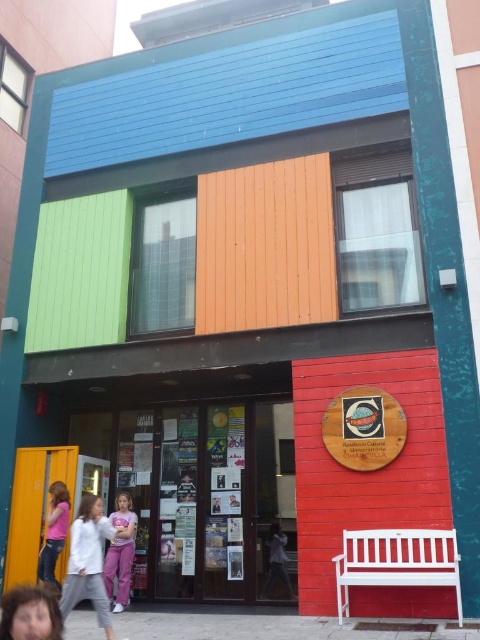
You are a delivery person trying to deliver a package to the address shown in the image. The package is too large to fit through the glass door at center. Can you use the pink fabric shirt at lower left as an alternative entrance?

The glass door at center has a larger size compared to the pink fabric shirt at lower left. Since the package is too large for the glass door at center, the pink fabric shirt at lower left is even smaller and cannot be used as an entrance.

From the picture: You are standing in front of the building and notice the purple cotton pants at center and the pink fabric shirt at lower left. Which item is closer to you?

The purple cotton pants at center is closer to you because it is further to the viewer than the pink fabric shirt at lower left.

You are a delivery person standing at the entrance of the building and need to place a package between the light purple pants at lower left and purple cotton pants at center. The package requires 5 feet of space. Can you fit it there?

The light purple pants at lower left and purple cotton pants at center are 5.10 feet apart, so yes, the package requiring 5 feet of space can fit between them since the distance is sufficient.